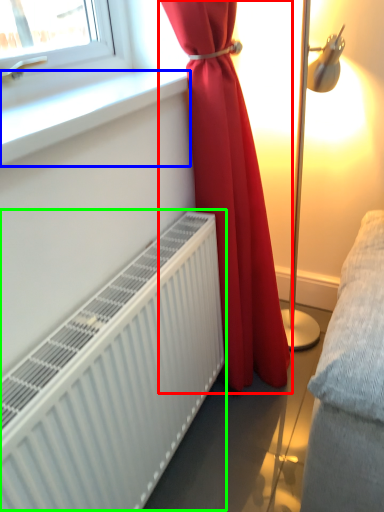
Question: Which object is the closest to the curtain (highlighted by a red box)? Choose among these: window sill (highlighted by a blue box) or radiator (highlighted by a green box).

Choices:
 (A) window sill
 (B) radiator

Answer: (B)